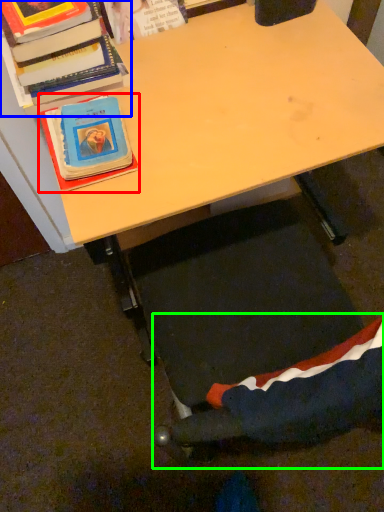
Question: Which object is the farthest from book (highlighted by a red box)? Choose among these: book (highlighted by a blue box) or swivel chair (highlighted by a green box).

Choices:
 (A) book
 (B) swivel chair

Answer: (B)